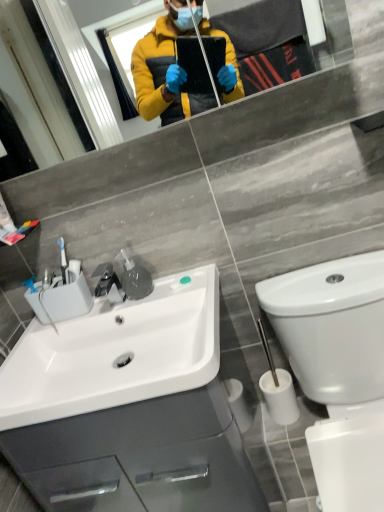
Question: Choose the correct answer: Is matte glass mirror at upper center inside white glossy cabinet at lower left or outside it?

Choices:
 (A) inside
 (B) outside

Answer: (B)

Question: Does point (365, 47) appear closer or farther from the camera than point (31, 488)?

Choices:
 (A) closer
 (B) farther

Answer: (A)

Question: Which object is the farthest from the white glossy cabinet at lower left?

Choices:
 (A) matte glass mirror at upper center
 (B) white glossy toilet at lower right
 (C) white glossy sink at lower left

Answer: (A)

Question: Considering the real-world distances, which object is closest to the white glossy cabinet at lower left?

Choices:
 (A) white glossy toilet at lower right
 (B) matte glass mirror at upper center
 (C) white glossy sink at lower left

Answer: (C)